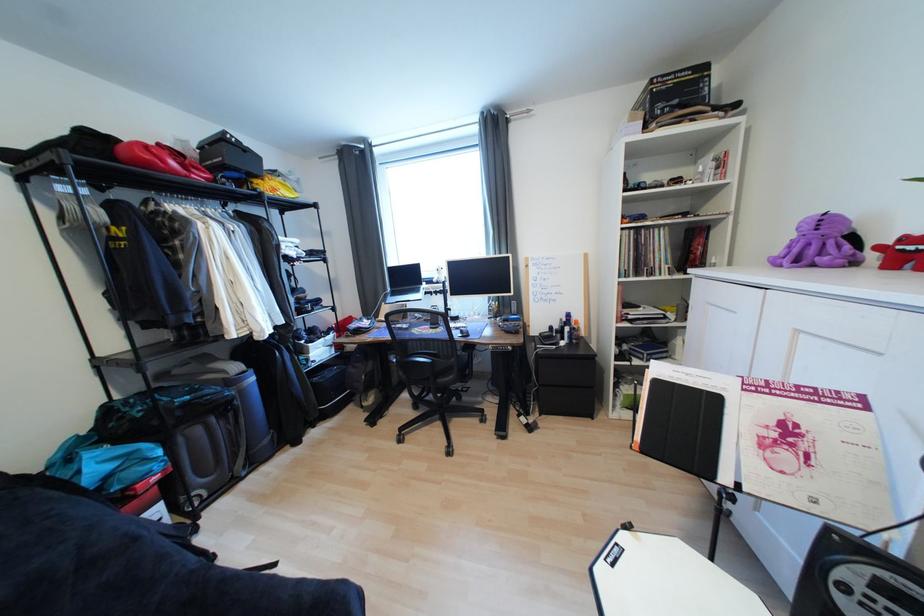
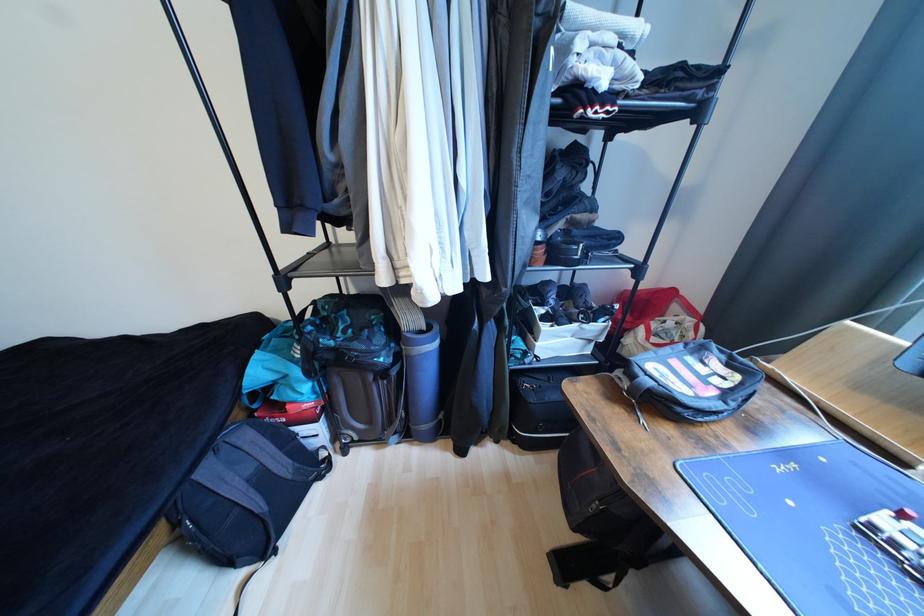
In the second image, find the point that corresponds to (317,346) in the first image.

(552, 329)